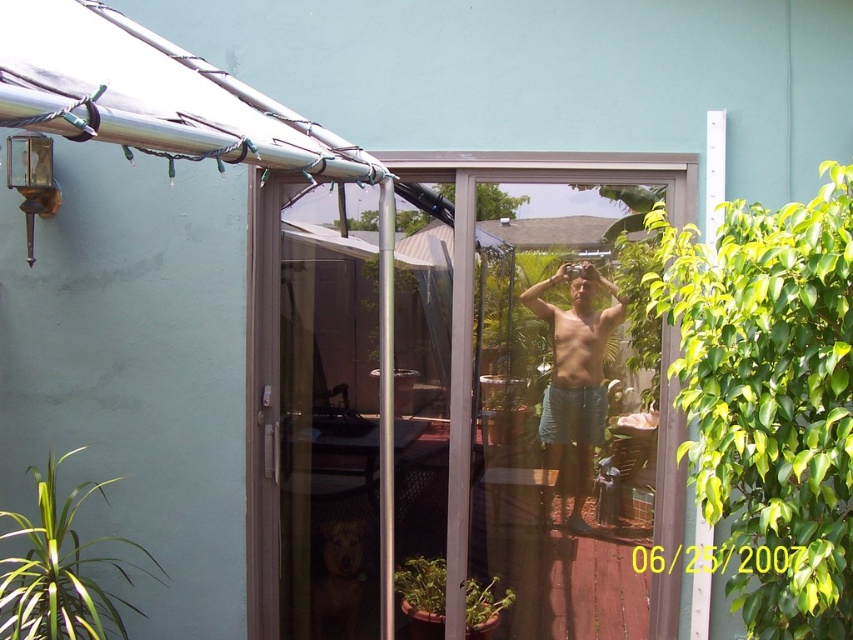
Question: Among these objects, which one is farthest from the camera?

Choices:
 (A) muscle at center
 (B) matte blue shorts at center
 (C) clear plastic screen door at center

Answer: (A)

Question: Is clear plastic screen door at center closer to the viewer compared to muscle at center?

Choices:
 (A) no
 (B) yes

Answer: (B)

Question: Can you confirm if clear glass door at center is positioned to the left of clear plastic screen door at center?

Choices:
 (A) yes
 (B) no

Answer: (B)

Question: Which object is closer to the camera taking this photo?

Choices:
 (A) muscle at center
 (B) clear glass door at center

Answer: (B)

Question: Does clear plastic screen door at center come behind muscle at center?

Choices:
 (A) no
 (B) yes

Answer: (A)

Question: Which point appears farthest from the camera in this image?

Choices:
 (A) (575, 355)
 (B) (453, 312)
 (C) (570, 365)
 (D) (364, 604)

Answer: (D)